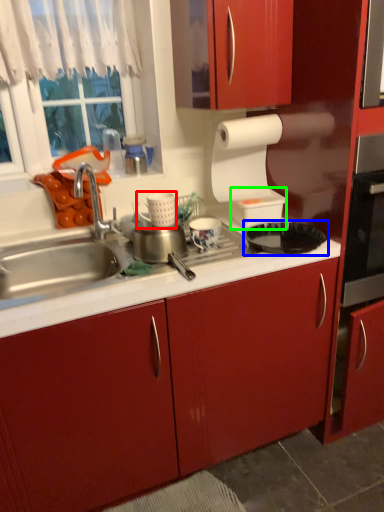
Question: Considering the real-world distances, which object is closest to appliance (highlighted by a red box)? kitchen appliance (highlighted by a blue box) or appliance (highlighted by a green box).

Choices:
 (A) kitchen appliance
 (B) appliance

Answer: (A)